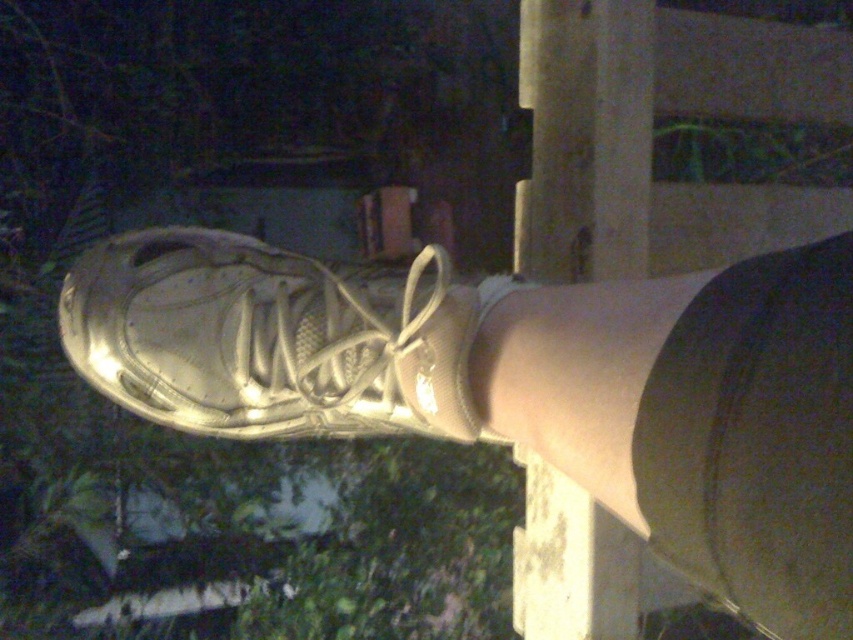
Based on the photo, you are a delivery robot with a 12 inch wide package. You need to move from the metallic gold shoe at center to the smooth concrete pole at center. Can you fit through the space between them?

The distance between the metallic gold shoe at center and the smooth concrete pole at center is 13.09 inches. Since your package is 12 inches wide, you can fit through the space between them as the distance is slightly larger than the package width.

You are a delivery robot that needs to navigate through a narrow alley. You see a metallic gold shoe at center and a smooth concrete pole at center in your path. Can you pass between them without touching either?

The metallic gold shoe at center is not as tall as the smooth concrete pole at center, so the robot can pass between them as there is enough vertical space.